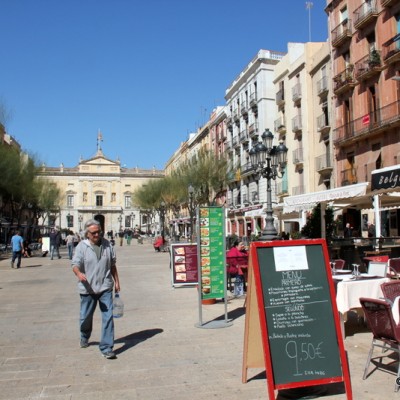
Find the location of a particular element. chairs at restaurant is located at coordinates (381, 325), (390, 288).